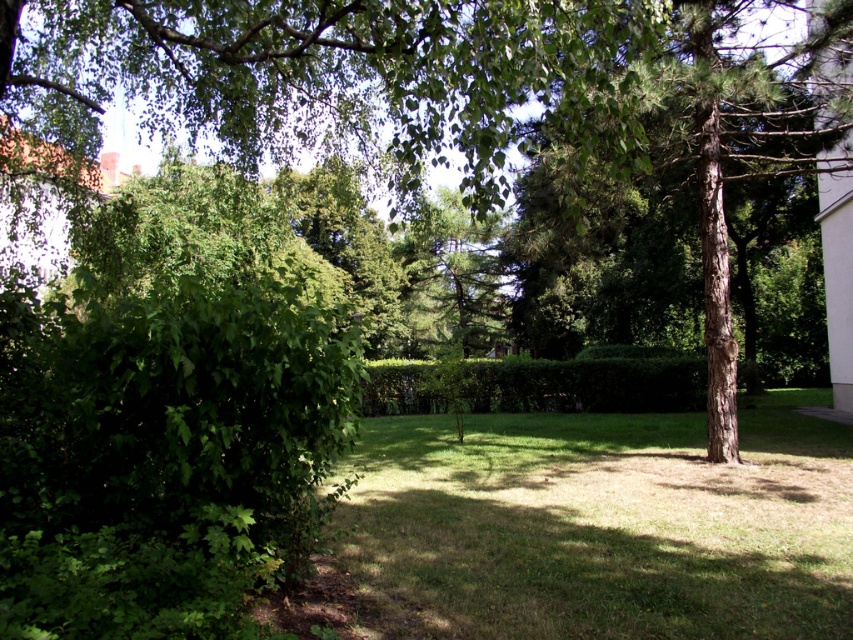
Question: Can you confirm if brown rough bark tree at center is smaller than green leafy hedge at center?

Choices:
 (A) no
 (B) yes

Answer: (A)

Question: Which point appears farthest from the camera in this image?

Choices:
 (A) (560, 129)
 (B) (693, 378)

Answer: (B)

Question: Is brown rough bark tree at center above green leafy hedge at center?

Choices:
 (A) yes
 (B) no

Answer: (A)

Question: Can you confirm if brown rough bark tree at center is positioned to the right of green leafy hedge at center?

Choices:
 (A) no
 (B) yes

Answer: (B)